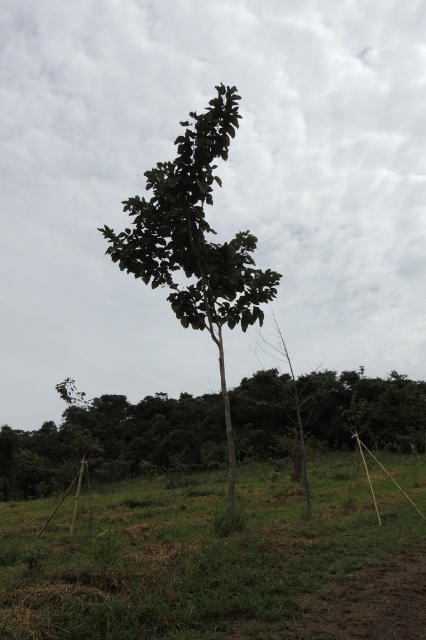
Question: Which is nearer to the green leafy tree at center?

Choices:
 (A) green leafy tree at lower left
 (B) green grass at center

Answer: (B)

Question: Is green leafy tree at lower left closer to camera compared to green leafy tree at center?

Choices:
 (A) yes
 (B) no

Answer: (B)

Question: Is green grass at center above green leafy tree at lower left?

Choices:
 (A) yes
 (B) no

Answer: (A)

Question: Is green grass at center positioned before green leafy tree at center?

Choices:
 (A) yes
 (B) no

Answer: (A)

Question: Which object appears farthest from the camera in this image?

Choices:
 (A) green grass at center
 (B) green leafy tree at lower left
 (C) green leafy tree at center

Answer: (B)

Question: Estimate the real-world distances between objects in this image. Which object is closer to the green leafy tree at lower left?

Choices:
 (A) green leafy tree at center
 (B) green grass at center

Answer: (A)